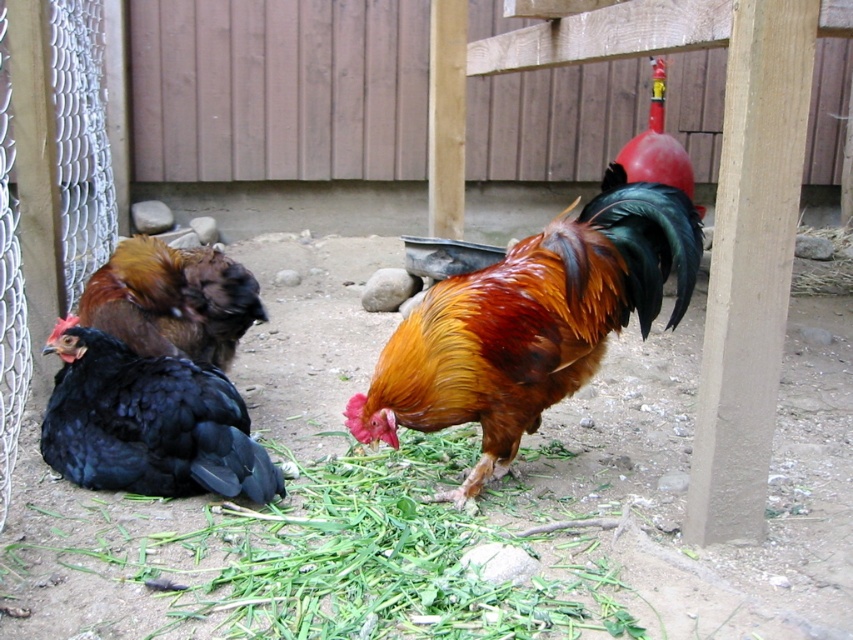
You are a gardener who wants to plant a small flower in the green leafy grass at center. However, you notice the black matte chicken at lower left is nearby. Based on their positions, can you safely plant the flower without disturbing the chicken?

The green leafy grass at center is below the black matte chicken at lower left, meaning the chicken is positioned above the grass. Since the chicken is above the grass, planting the flower in the grass might disturb the chicken as it is nearby.

You are a gardener who wants to plant a new flower in the backyard. You see the green leafy grass at center and the shiny brown rooster at center. Which object is closer to you, and why?

The green leafy grass at center is closer to you because it is positioned in front of the shiny brown rooster at center.

Looking at this image, you are a chicken in the backyard and want to reach the shiny brown rooster at center. Which direction should you move from the green leafy grass at center to approach the rooster?

The green leafy grass at center is positioned on the left side of the shiny brown rooster at center, so you should move to the right to approach the rooster.